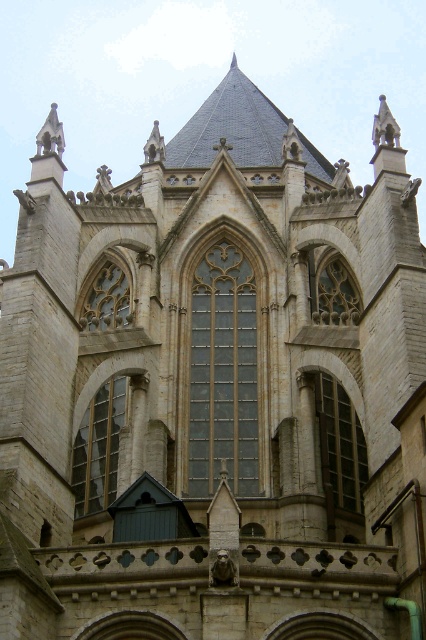
Is clear glass window at center wider than transparent glass window at center?

Yes, clear glass window at center is wider than transparent glass window at center.

Looking at this image, how much distance is there between clear glass window at center and transparent glass window at center?

A distance of 24.59 feet exists between clear glass window at center and transparent glass window at center.

Is point (193, 397) positioned before point (75, 458)?

Yes.

Where is `clear glass window at center`? This screenshot has width=426, height=640. clear glass window at center is located at coordinates (222, 372).

Can you confirm if clear glass window at center is positioned to the right of clear glass window at upper center?

Correct, you'll find clear glass window at center to the right of clear glass window at upper center.

Can you confirm if clear glass window at center is wider than clear glass window at upper center?

No.

Between point (216, 458) and point (100, 308), which one is positioned in front?

Point (216, 458) is more forward.

Locate an element on the screen. clear glass window at center is located at coordinates (222, 372).

This screenshot has width=426, height=640. What do you see at coordinates (222, 372) in the screenshot?
I see `clear glass window at center` at bounding box center [222, 372].

Which is in front, point (250, 417) or point (339, 401)?

Point (250, 417)

The height and width of the screenshot is (640, 426). Identify the location of clear glass window at center. (222, 372).